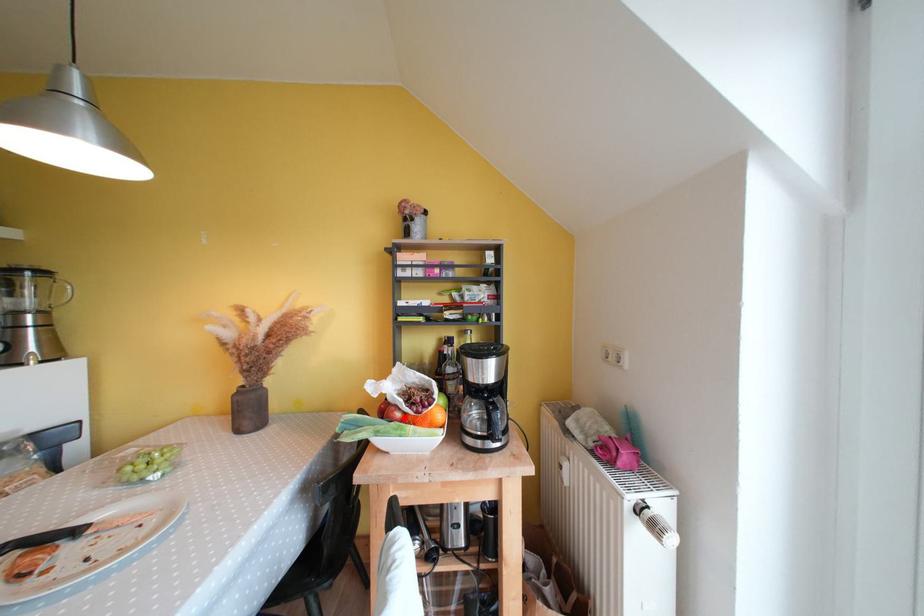
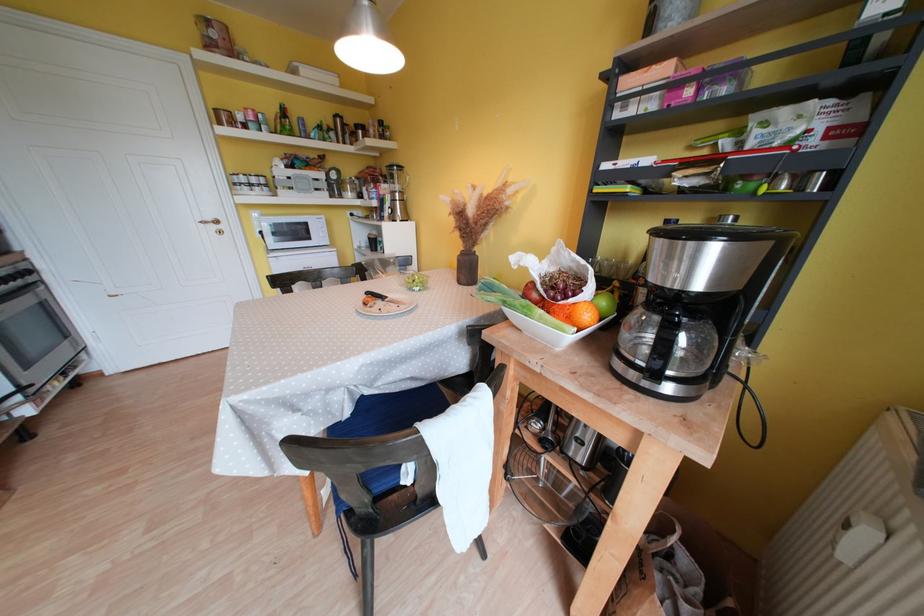
Find the pixel in the second image that matches the highlighted location in the first image.

(541, 299)